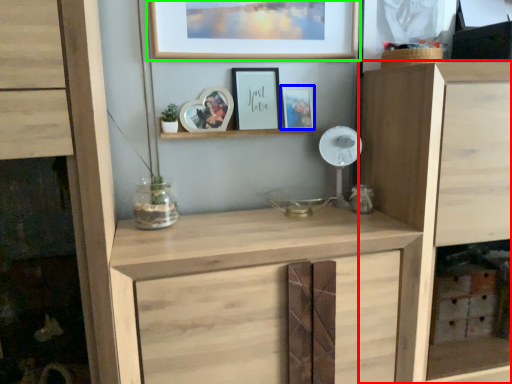
Question: Estimate the real-world distances between objects in this image. Which object is farther from cupboard (highlighted by a red box), picture frame (highlighted by a blue box) or picture frame (highlighted by a green box)?

Choices:
 (A) picture frame
 (B) picture frame

Answer: (B)